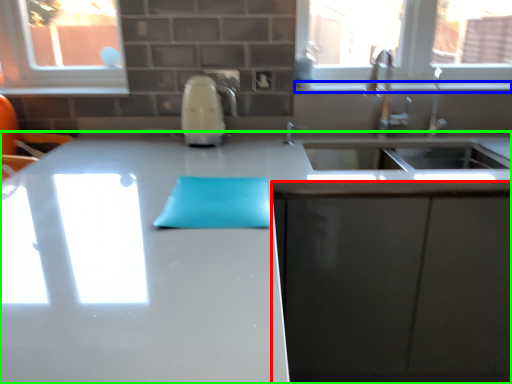
Question: Based on their relative distances, which object is farther from cabinetry (highlighted by a red box)? Choose from window sill (highlighted by a blue box) and countertop (highlighted by a green box).

Choices:
 (A) window sill
 (B) countertop

Answer: (A)